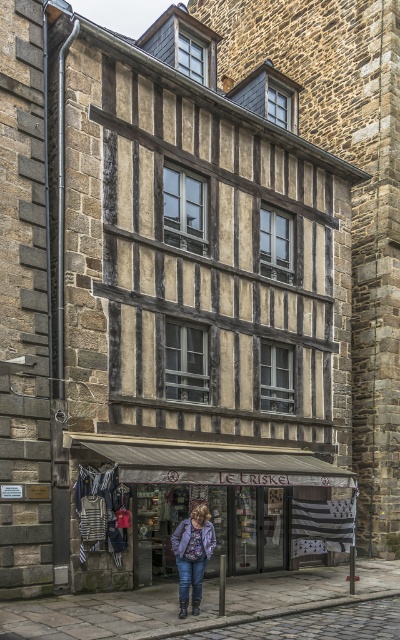
You are standing in front of the half timbered building. You see a point at coordinate (212, 500). What is at that point?

At point (212, 500) lies the matte gray awning at center.

You are a customer standing in front of the shop Le Triskel. You see the white canvas awning at lower center and the denim jacket at center. Which object is positioned higher?

The white canvas awning at lower center is above the denim jacket at center, so the white canvas awning at lower center is positioned higher.

You are standing in front of the building and want to locate the matte gray awning at center. Where would you look?

You should look at point (212, 500) to find the matte gray awning at center.